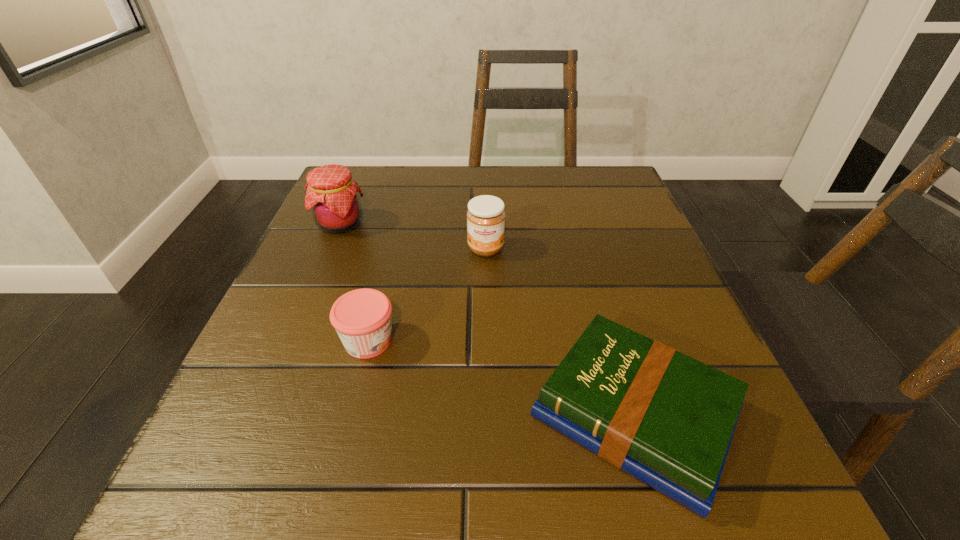
Locate an element on the screen. The width and height of the screenshot is (960, 540). object situated at the far edge is located at coordinates (332, 194).

What are the coordinates of `object present at the near edge` in the screenshot? It's located at (667, 419).

Identify the location of object that is at the right edge. click(x=667, y=419).

Image resolution: width=960 pixels, height=540 pixels. I want to click on object situated at the far left corner, so click(332, 194).

I want to click on object that is at the near right corner, so click(667, 419).

Identify the location of vacant space at the far edge of the desktop. (507, 213).

The width and height of the screenshot is (960, 540). In the image, there is a desktop. In order to click on vacant space at the near edge in this screenshot , I will do `click(372, 453)`.

Image resolution: width=960 pixels, height=540 pixels. I want to click on free region at the left edge of the desktop, so 386,240.

The width and height of the screenshot is (960, 540). I want to click on vacant space at the right edge of the desktop, so click(x=715, y=355).

The height and width of the screenshot is (540, 960). In order to click on vacant space at the far left corner of the desktop in this screenshot , I will do `click(369, 174)`.